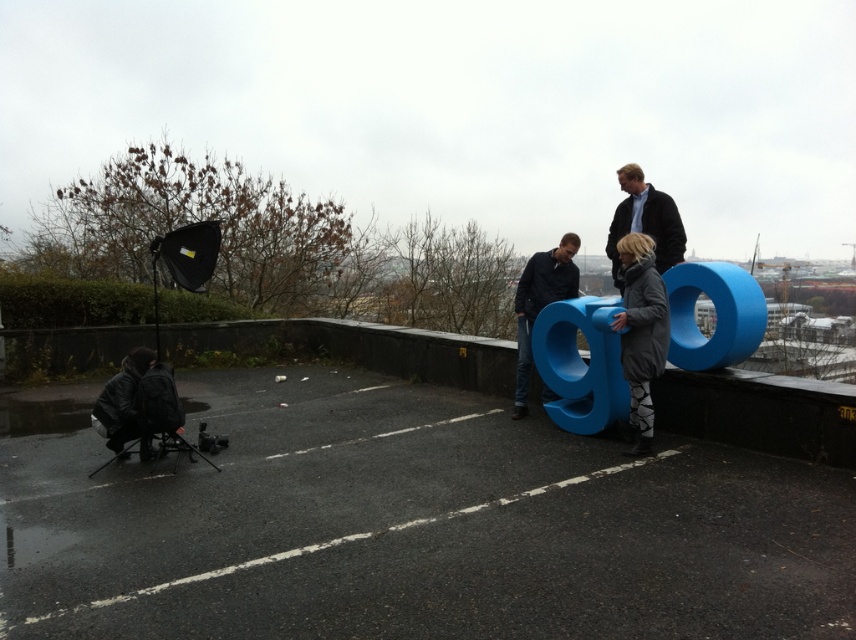
Question: Does black asphalt parking lot at lower left appear under matte black backpack at lower left?

Choices:
 (A) no
 (B) yes

Answer: (B)

Question: Which object is closer to the camera taking this photo?

Choices:
 (A) gray woolen coat at center
 (B) black asphalt parking lot at lower left

Answer: (A)

Question: Is blue rubber letter at center wider than dark blue jacket at upper center?

Choices:
 (A) yes
 (B) no

Answer: (A)

Question: Is dark blue jacket at upper center thinner than matte black backpack at lower left?

Choices:
 (A) no
 (B) yes

Answer: (A)

Question: Which point is farther to the camera?

Choices:
 (A) (658, 202)
 (B) (550, 260)
 (C) (627, 374)
 (D) (150, 360)

Answer: (B)

Question: Which object appears farthest from the camera in this image?

Choices:
 (A) matte black backpack at lower left
 (B) blue rubber letter at center
 (C) dark blue jacket at upper center

Answer: (B)